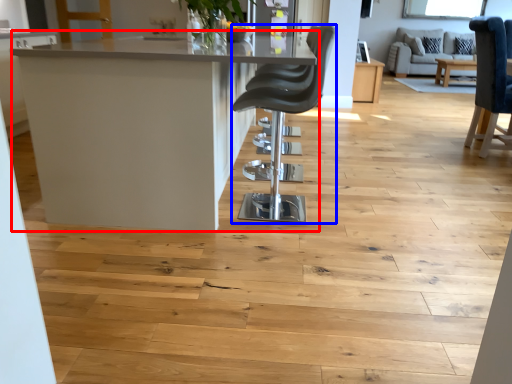
Question: Which object appears farthest to the camera in this image, table (highlighted by a red box) or chair (highlighted by a blue box)?

Choices:
 (A) table
 (B) chair

Answer: (B)